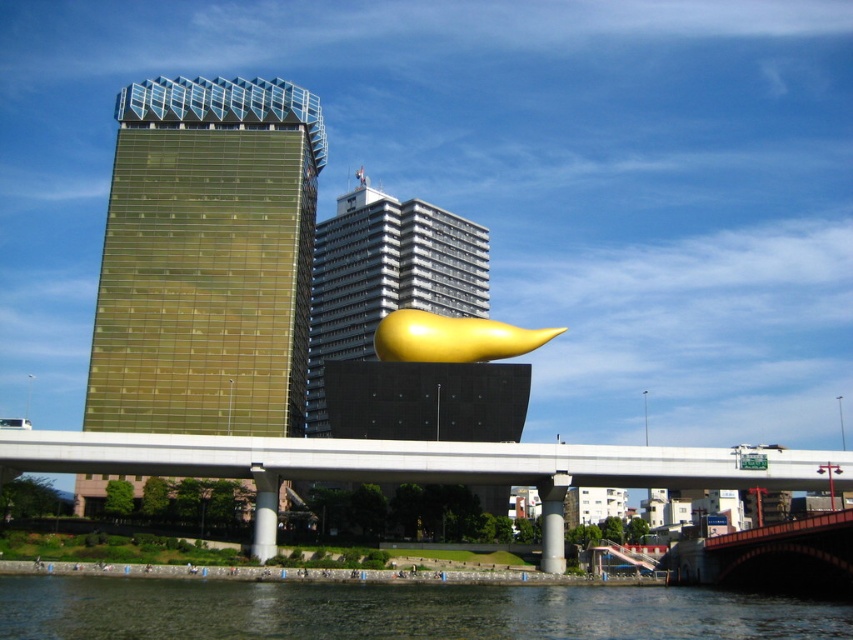
Between greenish water at lower center and gold reflective tower at center, which one appears on the left side from the viewer's perspective?

gold reflective tower at center is more to the left.

Does greenish water at lower center come in front of gold reflective tower at center?

Yes, it is.

Is point (151, 605) more distant than point (456, 224)?

No, it is in front of (456, 224).

Identify the location of greenish water at lower center. This screenshot has width=853, height=640. (396, 611).

This screenshot has height=640, width=853. Describe the element at coordinates (206, 259) in the screenshot. I see `gold reflective glass tower at left` at that location.

Measure the distance between point [167,362] and camera.

Point [167,362] is 98.69 meters from camera.

Where is `gold reflective glass tower at left`? gold reflective glass tower at left is located at coordinates (206, 259).

Between point (167, 291) and point (454, 602), which one is positioned behind?

The point (167, 291) is more distant.

Does point (229, 397) come in front of point (647, 588)?

No, it is not.

What are the coordinates of `gold reflective glass tower at left` in the screenshot? It's located at pyautogui.click(x=206, y=259).